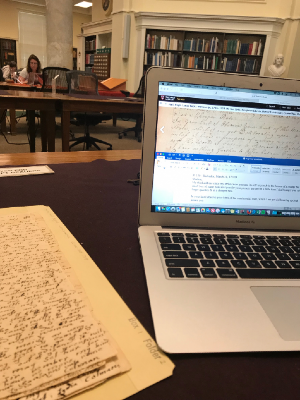
I want to click on window, so click(34, 29).